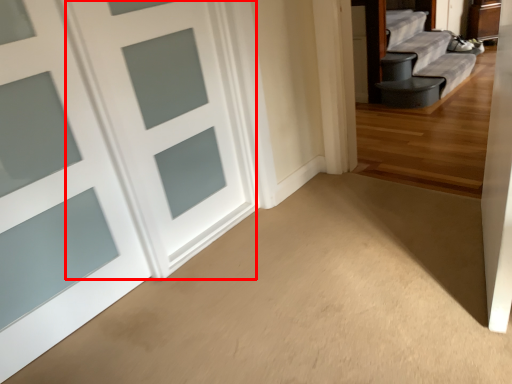
Question: Observing the image, what is the correct spatial positioning of door (annotated by the red box) in reference to door?

Choices:
 (A) right
 (B) left

Answer: (A)